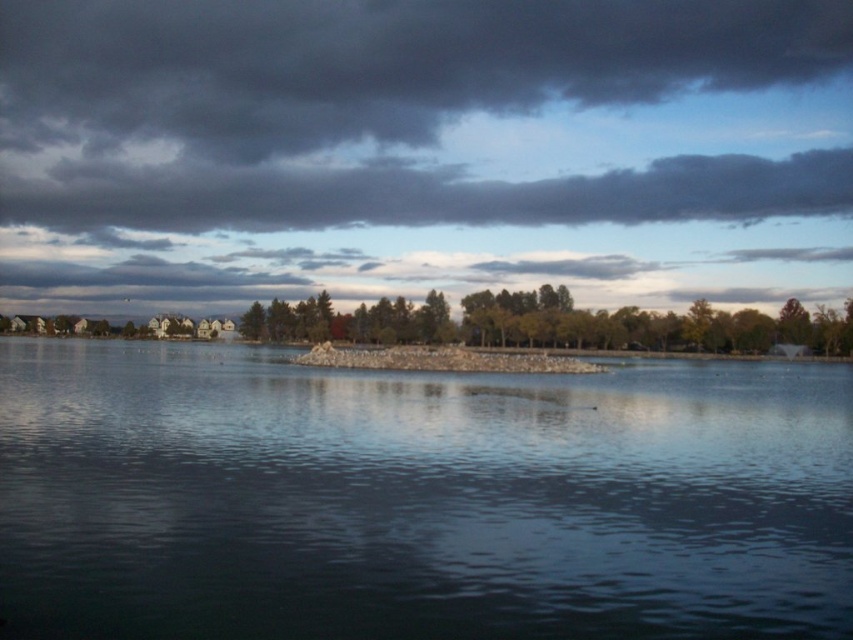
You are an observer standing at the lakeside. You notice the transparent water at center and the green matte tree at upper right. Which object is located above the other?

The green matte tree at upper right is positioned above the transparent water at center.

You are a photographer planning to capture the entire scene in one shot. Given that your camera can only focus on objects within a 10m width, will the transparent water at center and the green matte tree at upper right fit within this constraint?

The transparent water at center is wider than the green matte tree at upper right. Since the camera can focus on objects within a 10m width, both objects can fit as long as their combined width does not exceed 10m. However, the description only states the comparison of their widths, not the exact measurements. Without specific dimensions, it is uncertain if they fit within the 10m constraint.

You are an artist painting the lakeside scene. You want to ensure the transparent water at center and the green matte tree at upper right are proportionally accurate. Which object should you paint first if you want to start with the larger one?

The green matte tree at upper right is larger than the transparent water at center, so you should paint the green matte tree at upper right first.